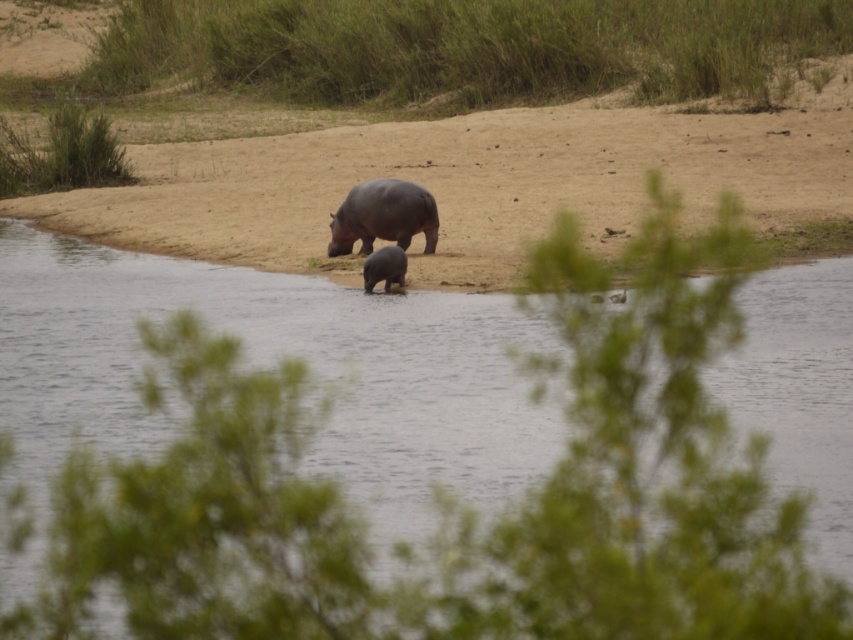
You are a photographer standing in front of the scene with two hippos. You notice two points marked in the image, one at coordinates point [84,275] and another at point [395,276]. If you want to focus on the point that is closer to you, which coordinate should you choose?

You should choose point [84,275] because it is further to the camera than point [395,276], making it closer to you.

Based on the photo, you are standing at the edge of the water in the scene and want to reach a specific point marked at coordinates point [369,353]. If your maximum comfortable walking distance is 50 feet, will you be able to reach that point without feeling strained?

The point [369,353] is 53.55 feet away from the viewer, which exceeds your maximum comfortable walking distance of 50 feet. Therefore, reaching that point may cause some strain.